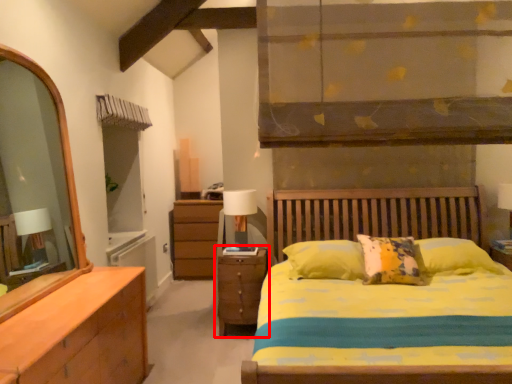
Question: Considering the relative positions of nightstand (annotated by the red box) and table lamp in the image provided, where is nightstand (annotated by the red box) located with respect to the staircase?

Choices:
 (A) left
 (B) right

Answer: (B)